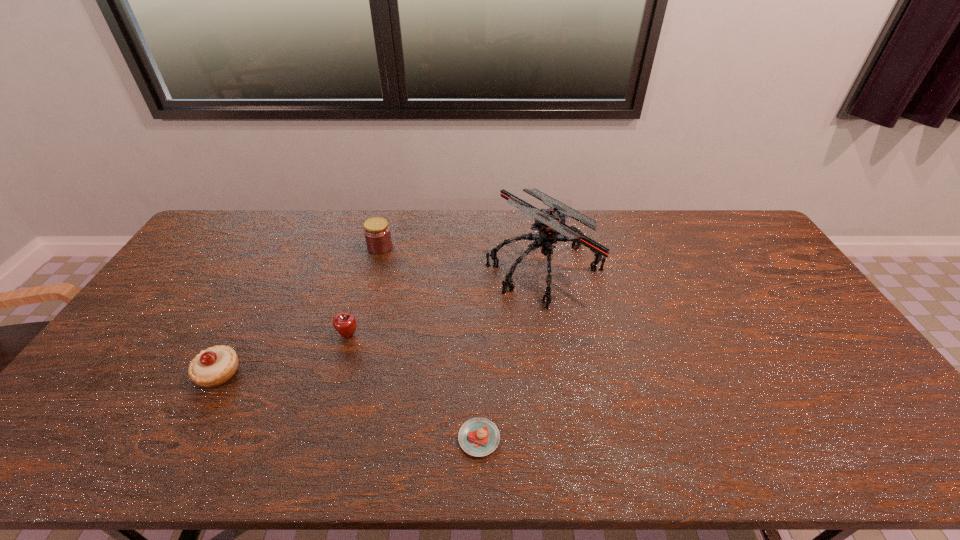
Find the location of a particular element. This screenshot has height=540, width=960. object that is the second closest to the apple is located at coordinates (377, 233).

Locate an element on the screen. This screenshot has width=960, height=540. the second closest object to the second tallest object is located at coordinates (345, 324).

Image resolution: width=960 pixels, height=540 pixels. I want to click on vacant space that satisfies the following two spatial constraints: 1. on the front side of the nearer pastry; 2. on the left side of the taller pastry, so click(184, 438).

Where is `vacant region that satisfies the following two spatial constraints: 1. on the back side of the third farthest object; 2. on the right side of the jam`? Image resolution: width=960 pixels, height=540 pixels. vacant region that satisfies the following two spatial constraints: 1. on the back side of the third farthest object; 2. on the right side of the jam is located at coordinates (373, 247).

This screenshot has height=540, width=960. I want to click on blank area in the image that satisfies the following two spatial constraints: 1. on the back side of the apple; 2. on the left side of the drone, so (x=368, y=267).